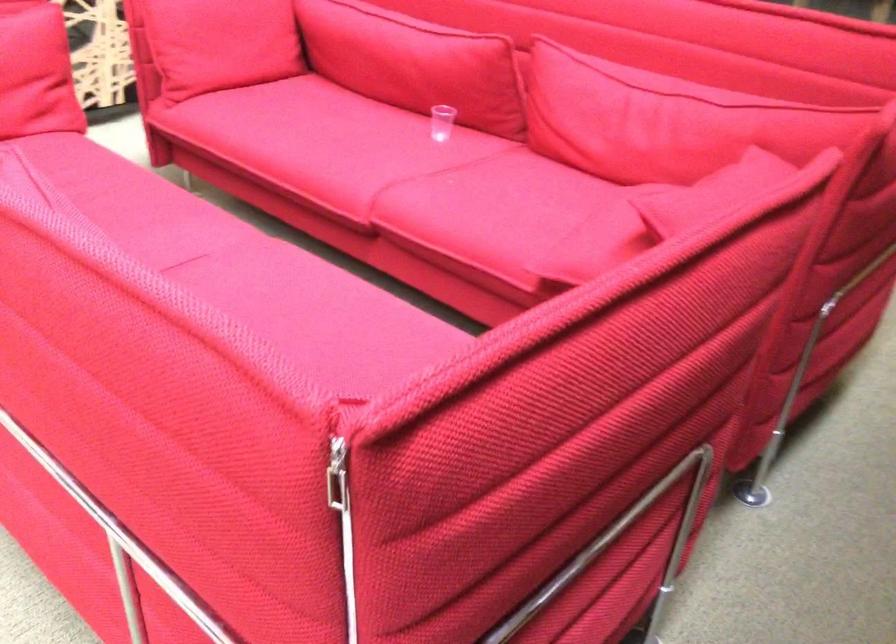
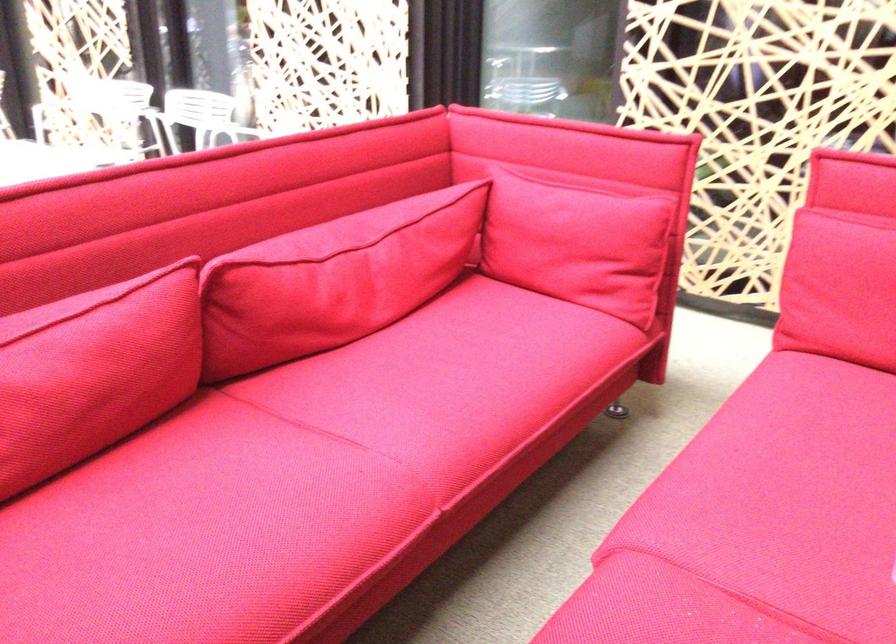
Where in the second image is the point corresponding to the point at 254,275 from the first image?

(298, 476)